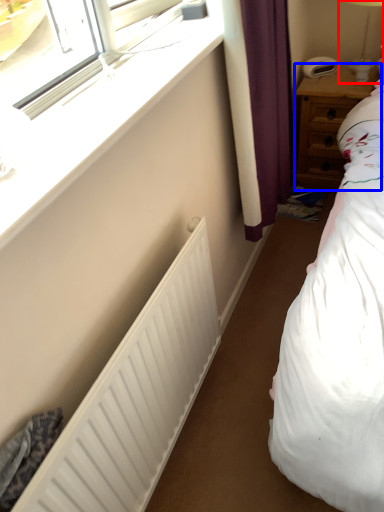
Question: Among these objects, which one is nearest to the camera, bedside lamp (highlighted by a red box) or nightstand (highlighted by a blue box)?

Choices:
 (A) bedside lamp
 (B) nightstand

Answer: (A)